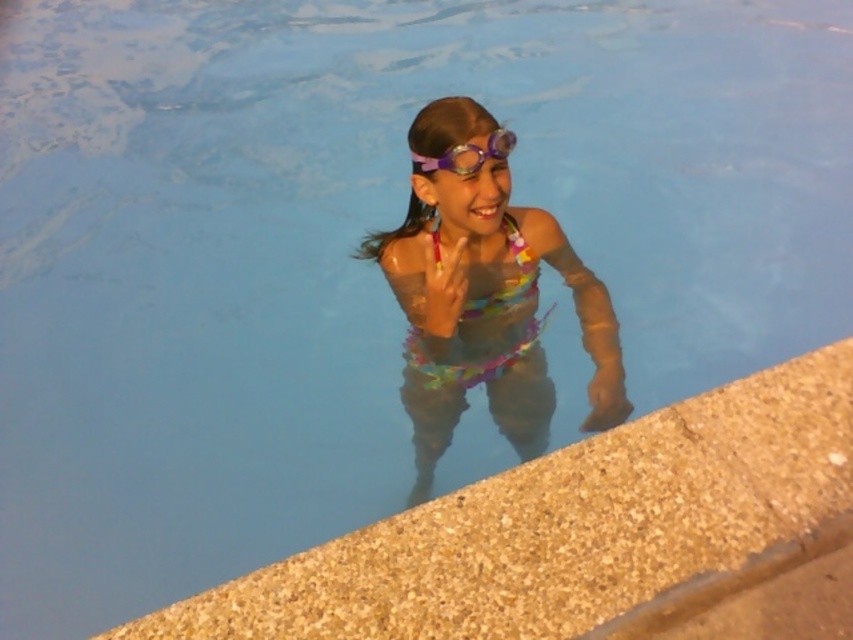
In the scene shown: You are a photographer trying to capture the girl in the pool. You want to ensure that both the multicolored fabric swimsuit at center and the purple matte goggles at upper center are clearly visible in the photo. Based on their sizes, which object should you focus on first to ensure proper framing?

The multicolored fabric swimsuit at center is taller than the purple matte goggles at upper center, so focusing on the multicolored fabric swimsuit at center first will ensure proper framing as it occupies more space in the image.

You are a lifeguard who needs to place a small first aid kit on the smooth concrete ledge at lower right without blocking the view of the purple matte goggles at upper center. Can you fit the first aid kit there?

The smooth concrete ledge at lower right is larger in size than the purple matte goggles at upper center, so yes, the first aid kit can be placed on the smooth concrete ledge at lower right without blocking the view of the purple matte goggles at upper center since the ledge has enough space.